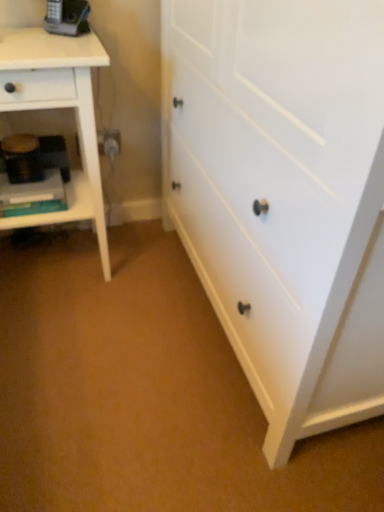
Question: From a real-world perspective, does matte black phone at upper left stand above white wood nightstand at left?

Choices:
 (A) yes
 (B) no

Answer: (A)

Question: Does matte black phone at upper left turn towards white wood nightstand at left?

Choices:
 (A) yes
 (B) no

Answer: (B)

Question: From the image's perspective, is matte black phone at upper left above white wood nightstand at left?

Choices:
 (A) no
 (B) yes

Answer: (B)

Question: Considering the relative positions of matte black phone at upper left and white wood nightstand at left in the image provided, is matte black phone at upper left to the right of white wood nightstand at left from the viewer's perspective?

Choices:
 (A) yes
 (B) no

Answer: (A)

Question: Can we say matte black phone at upper left lies outside white wood nightstand at left?

Choices:
 (A) no
 (B) yes

Answer: (B)

Question: Can you confirm if matte black phone at upper left is positioned to the left of white wood nightstand at left?

Choices:
 (A) no
 (B) yes

Answer: (A)

Question: From a real-world perspective, is white matte chest of drawers at center under matte black phone at upper left?

Choices:
 (A) no
 (B) yes

Answer: (B)

Question: Is white matte chest of drawers at center not within matte black phone at upper left?

Choices:
 (A) no
 (B) yes

Answer: (B)

Question: From a real-world perspective, is white matte chest of drawers at center over matte black phone at upper left?

Choices:
 (A) no
 (B) yes

Answer: (A)

Question: From the image's perspective, is white matte chest of drawers at center on top of matte black phone at upper left?

Choices:
 (A) yes
 (B) no

Answer: (B)

Question: Is white matte chest of drawers at center closer to camera compared to matte black phone at upper left?

Choices:
 (A) no
 (B) yes

Answer: (B)

Question: From the image's perspective, is white matte chest of drawers at center below matte black phone at upper left?

Choices:
 (A) no
 (B) yes

Answer: (B)

Question: Is the position of white matte chest of drawers at center less distant than that of white wood nightstand at left?

Choices:
 (A) yes
 (B) no

Answer: (A)